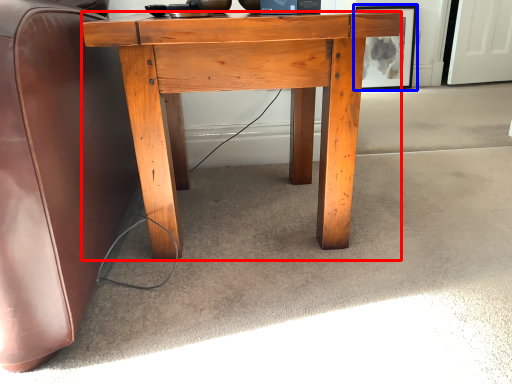
Question: Among these objects, which one is nearest to the camera, desk (highlighted by a red box) or picture frame (highlighted by a blue box)?

Choices:
 (A) desk
 (B) picture frame

Answer: (A)